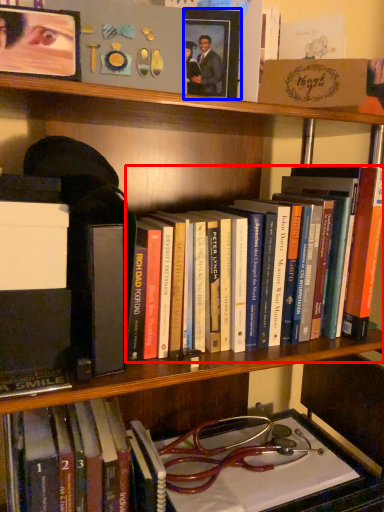
Question: Which object appears farthest to the camera in this image, book (highlighted by a red box) or picture frame (highlighted by a blue box)?

Choices:
 (A) book
 (B) picture frame

Answer: (B)